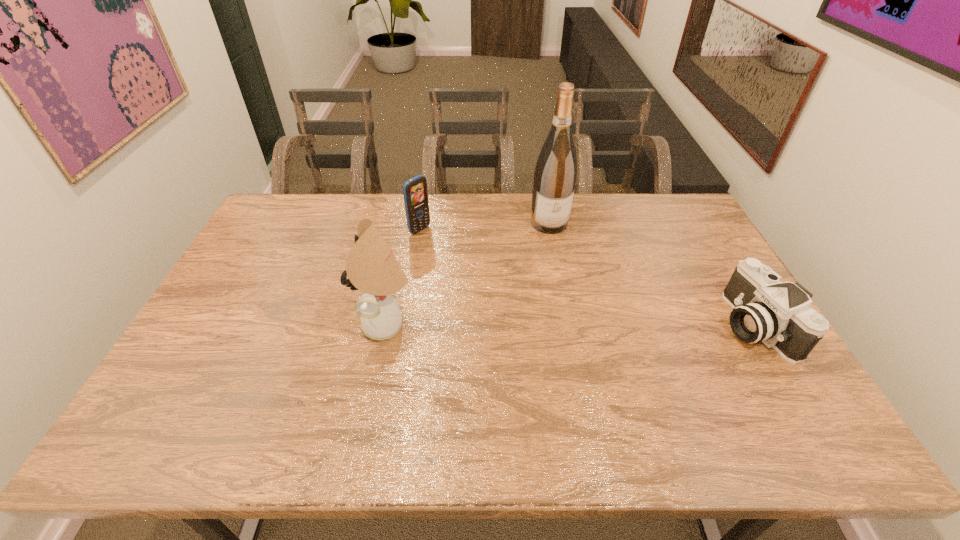
You are a GUI agent. You are given a task and a screenshot of the screen. Output one action in this format:
    pyautogui.click(x=<x>, y=<y>)
    Task: Click on the vacant point located between the wine bottle and the camera
    This screenshot has height=540, width=960.
    Given the screenshot: What is the action you would take?
    pyautogui.click(x=651, y=274)

The width and height of the screenshot is (960, 540). I want to click on free space that is in between the third object from left to right and the third tallest object, so click(x=485, y=227).

Identify the location of free area in between the rightmost object and the wine bottle. (651, 274).

Locate an element on the screen. vacant region between the wine bottle and the camera is located at coordinates (651, 274).

Select which object appears as the third closest to the cellular telephone. Please provide its 2D coordinates. Your answer should be formatted as a tuple, i.e. [(x, y)], where the tuple contains the x and y coordinates of a point satisfying the conditions above.

[(779, 314)]

The image size is (960, 540). I want to click on object that can be found as the second closest to the doll, so click(555, 175).